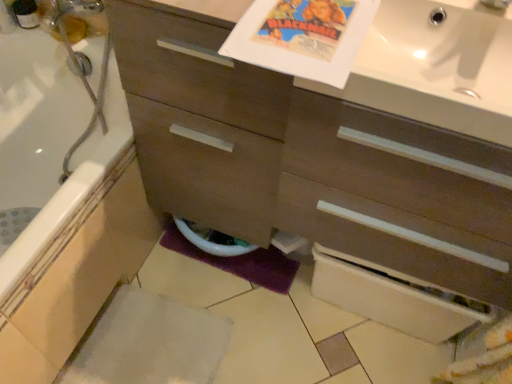
Question: Should I look upward or downward to see white glossy sink at upper right?

Choices:
 (A) up
 (B) down

Answer: (A)

Question: Considering the relative sizes of white glossy bathtub at lower left and matte brown cabinet at center in the image provided, is white glossy bathtub at lower left wider than matte brown cabinet at center?

Choices:
 (A) no
 (B) yes

Answer: (B)

Question: Would you say white glossy bathtub at lower left is outside matte brown cabinet at center?

Choices:
 (A) no
 (B) yes

Answer: (B)

Question: Are white glossy bathtub at lower left and matte brown cabinet at center located far from each other?

Choices:
 (A) yes
 (B) no

Answer: (B)

Question: Is white glossy bathtub at lower left to the left of matte brown cabinet at center from the viewer's perspective?

Choices:
 (A) yes
 (B) no

Answer: (A)

Question: Is white glossy bathtub at lower left thinner than matte brown cabinet at center?

Choices:
 (A) yes
 (B) no

Answer: (B)

Question: Does white glossy bathtub at lower left have a smaller size compared to matte brown cabinet at center?

Choices:
 (A) yes
 (B) no

Answer: (A)

Question: Can you confirm if white glossy sink at upper right is taller than white glossy toilet bowl at lower center?

Choices:
 (A) yes
 (B) no

Answer: (B)

Question: From the image's perspective, is white glossy sink at upper right under white glossy toilet bowl at lower center?

Choices:
 (A) yes
 (B) no

Answer: (B)

Question: Can you confirm if white glossy sink at upper right is wider than white glossy toilet bowl at lower center?

Choices:
 (A) yes
 (B) no

Answer: (A)

Question: Is white glossy sink at upper right behind white glossy toilet bowl at lower center?

Choices:
 (A) no
 (B) yes

Answer: (A)

Question: Is white glossy sink at upper right completely or partially outside of white glossy toilet bowl at lower center?

Choices:
 (A) yes
 (B) no

Answer: (A)

Question: Considering the relative positions of white glossy sink at upper right and white glossy toilet bowl at lower center in the image provided, is white glossy sink at upper right to the right of white glossy toilet bowl at lower center from the viewer's perspective?

Choices:
 (A) no
 (B) yes

Answer: (B)

Question: Is white glossy sink at upper right oriented towards matte brown cabinet at center?

Choices:
 (A) yes
 (B) no

Answer: (A)